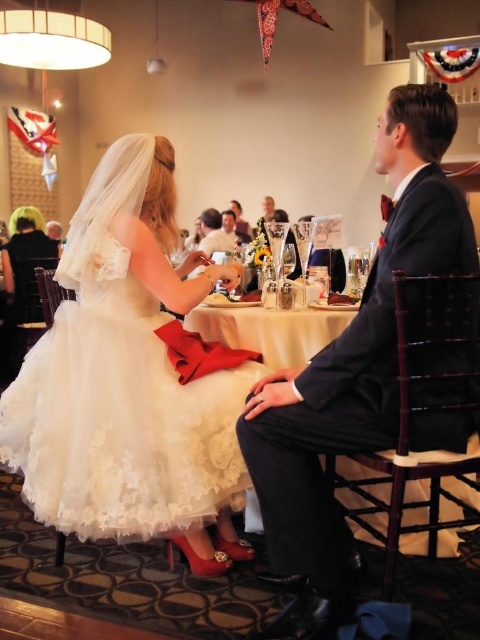
Is white lace tablecloth at center closer to camera compared to matte black suit at center?

Yes.

Between white lace tablecloth at center and matte black suit at center, which one is positioned higher?

matte black suit at center is above.

The image size is (480, 640). Find the location of `white lace tablecloth at center`. white lace tablecloth at center is located at coordinates (271, 328).

The width and height of the screenshot is (480, 640). Identify the location of white lace tablecloth at center. (271, 328).

In the scene shown: Who is taller, white lace dress at center or shiny black suit at center?

shiny black suit at center is taller.

Which is above, white lace dress at center or shiny black suit at center?

Positioned higher is shiny black suit at center.

Is point (173, 211) behind point (415, 147)?

Yes.

The width and height of the screenshot is (480, 640). I want to click on white lace dress at center, so click(129, 380).

Is shiny black suit at center to the left of white lace tablecloth at center from the viewer's perspective?

No, shiny black suit at center is not to the left of white lace tablecloth at center.

Between shiny black suit at center and white lace tablecloth at center, which one is positioned higher?

white lace tablecloth at center

Describe the element at coordinates (352, 368) in the screenshot. The height and width of the screenshot is (640, 480). I see `shiny black suit at center` at that location.

Find the location of a particular element. This screenshot has height=640, width=480. shiny black suit at center is located at coordinates (352, 368).